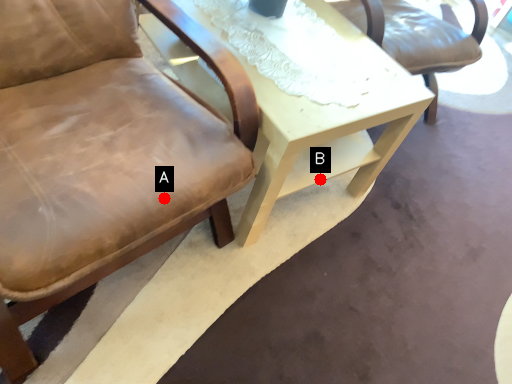
Question: Two points are circled on the image, labeled by A and B beside each circle. Which point is closer to the camera?

Choices:
 (A) A is closer
 (B) B is closer

Answer: (A)